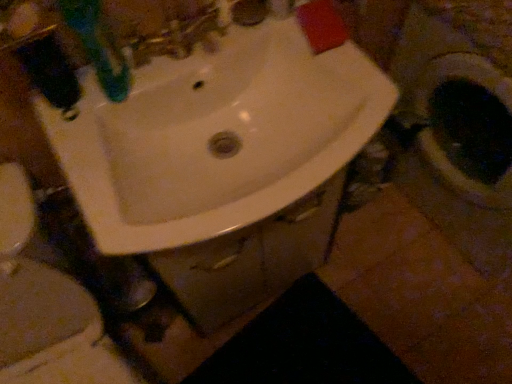
Where is `free space to the right of black matte rug at lower center`? free space to the right of black matte rug at lower center is located at coordinates (433, 322).